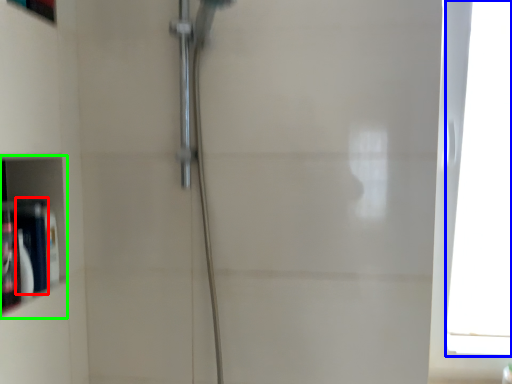
Question: Which object is positioned closest to toiletry (highlighted by a red box)? Select from window (highlighted by a blue box) and cabinet (highlighted by a green box).

Choices:
 (A) window
 (B) cabinet

Answer: (B)